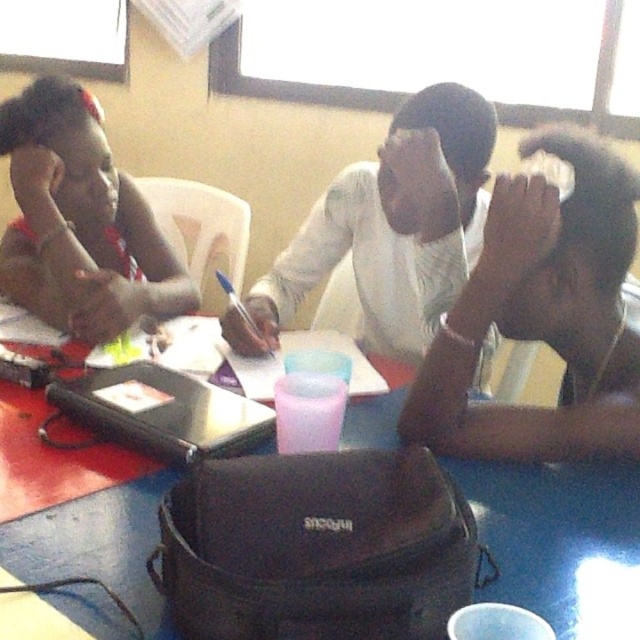
Is white matte shirt at center taller than black matte laptop at center?

Yes, white matte shirt at center is taller than black matte laptop at center.

Is white matte shirt at center shorter than black matte laptop at center?

Incorrect, white matte shirt at center's height does not fall short of black matte laptop at center's.

Describe the element at coordinates (388, 228) in the screenshot. I see `white matte shirt at center` at that location.

You are a GUI agent. You are given a task and a screenshot of the screen. Output one action in this format:
    pyautogui.click(x=<x>, y=<y>)
    Task: Click on the white matte shirt at center
    
    Given the screenshot: What is the action you would take?
    pyautogui.click(x=388, y=228)

At what (x,y) coordinates should I click in order to perform the action: click on smooth skin head at center. Please return your answer as a coordinate pair (x, y). This screenshot has height=640, width=640. Looking at the image, I should click on (544, 316).

Does smooth skin head at center appear on the left side of white matte shirt at center?

No, smooth skin head at center is not to the left of white matte shirt at center.

Which is behind, point (541, 269) or point (483, 196)?

The point (483, 196) is behind.

At what (x,y) coordinates should I click in order to perform the action: click on smooth skin head at center. Please return your answer as a coordinate pair (x, y). The width and height of the screenshot is (640, 640). Looking at the image, I should click on (544, 316).

Who is more distant from viewer, (129, 296) or (152, 442)?

Point (129, 296)

Between matte black laptop at left and black matte laptop at center, which one is positioned higher?

matte black laptop at left is higher up.

Is point (92, 230) behind point (97, 416)?

Yes, point (92, 230) is behind point (97, 416).

At what (x,y) coordinates should I click in order to perform the action: click on matte black laptop at left. Please return your answer as a coordinate pair (x, y). This screenshot has height=640, width=640. Looking at the image, I should click on (81, 221).